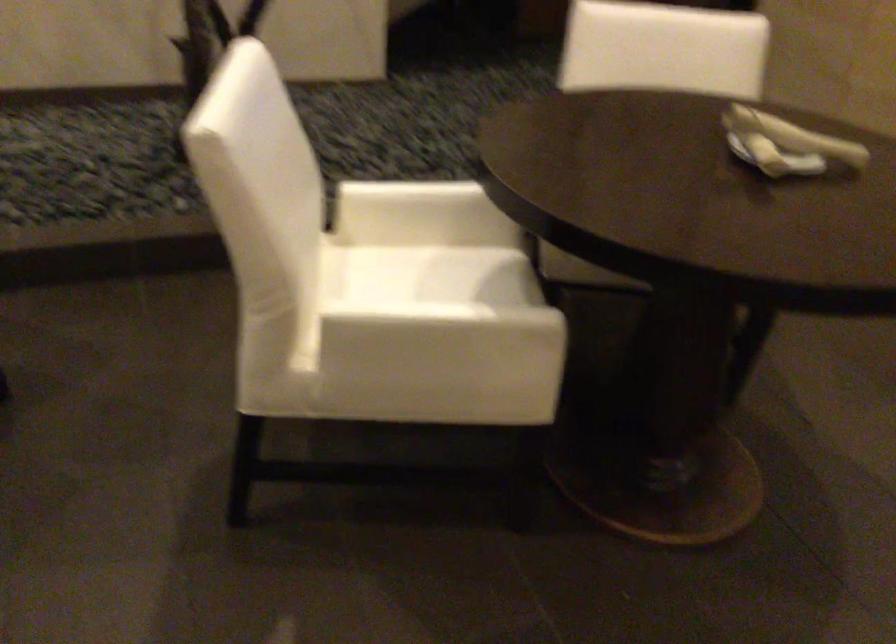
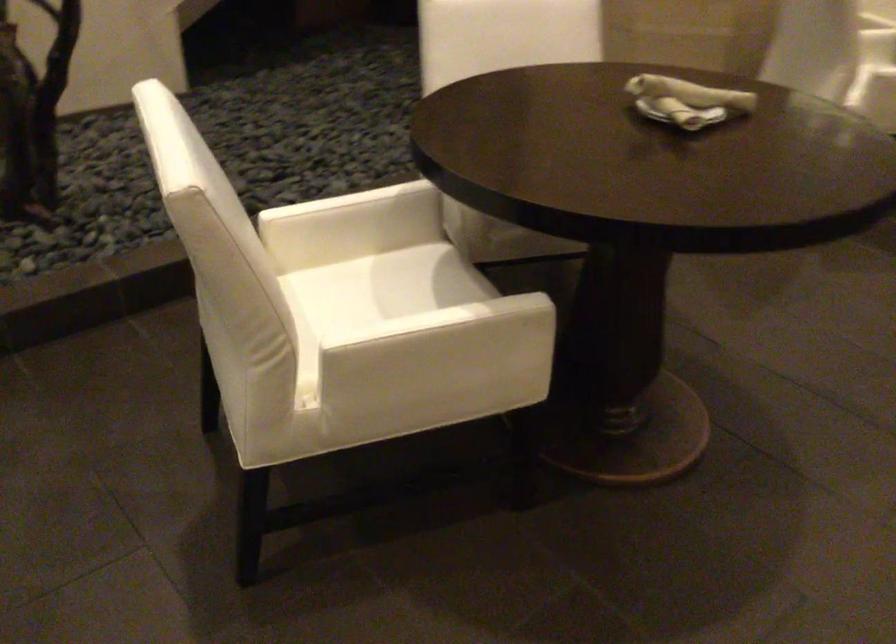
Question: The first image is from the beginning of the video and the second image is from the end. How did the camera likely rotate when shooting the video?

Choices:
 (A) Left
 (B) Right
 (C) Up
 (D) Down

Answer: (B)